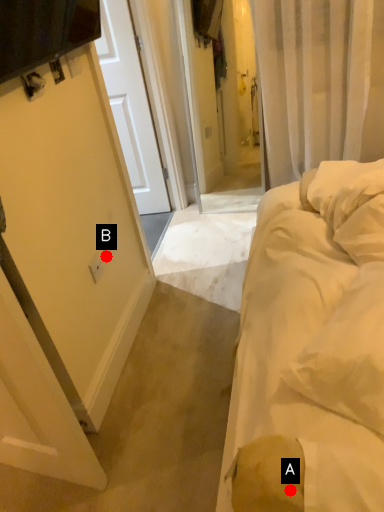
Question: Two points are circled on the image, labeled by A and B beside each circle. Which point appears closest to the camera in this image?

Choices:
 (A) A is closer
 (B) B is closer

Answer: (A)